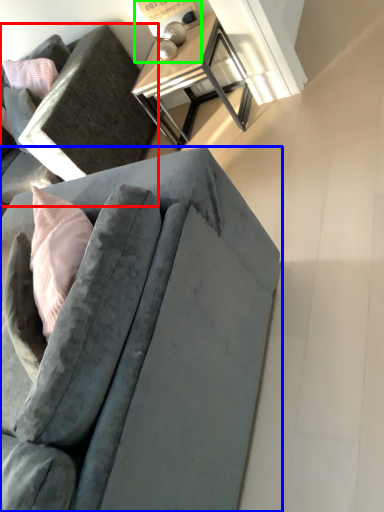
Question: Which object is the closest to the studio couch (highlighted by a red box)? Choose among these: studio couch (highlighted by a blue box) or table lamp (highlighted by a green box).

Choices:
 (A) studio couch
 (B) table lamp

Answer: (B)